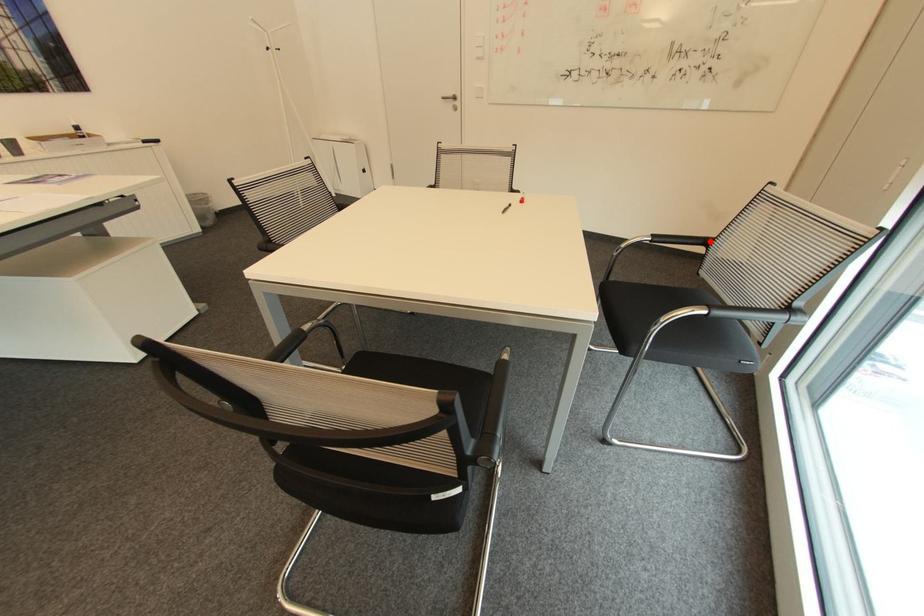
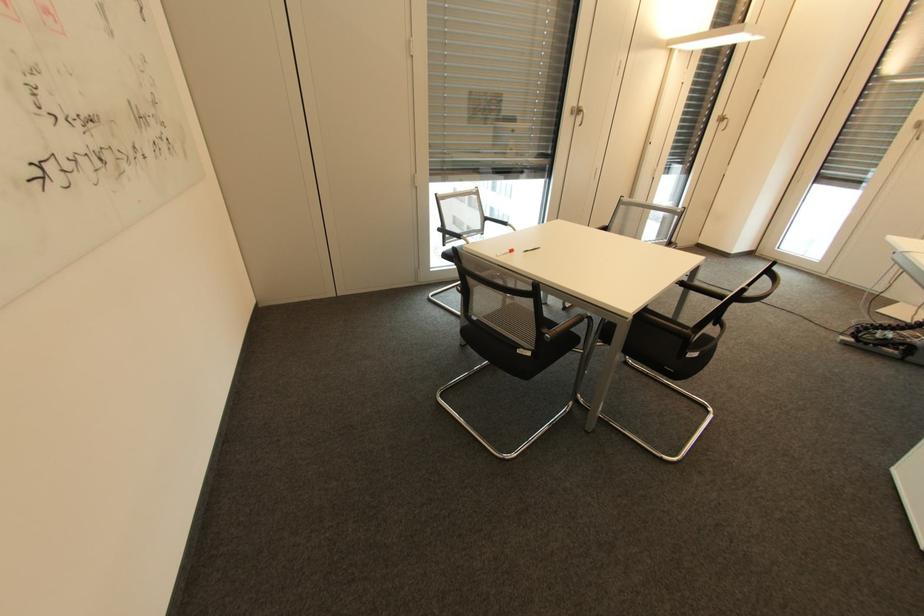
Locate, in the second image, the point that corresponds to the highlighted location in the first image.

(448, 229)